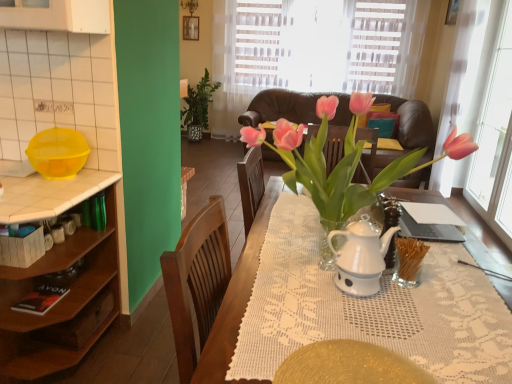
Locate an element on the screen. Image resolution: width=512 pixels, height=384 pixels. pink translucent screen at upper right is located at coordinates point(495,140).

What do you see at coordinates (495, 140) in the screenshot?
I see `pink translucent screen at upper right` at bounding box center [495, 140].

Where is `pink translucent screen at upper right`? This screenshot has height=384, width=512. pink translucent screen at upper right is located at coordinates (495, 140).